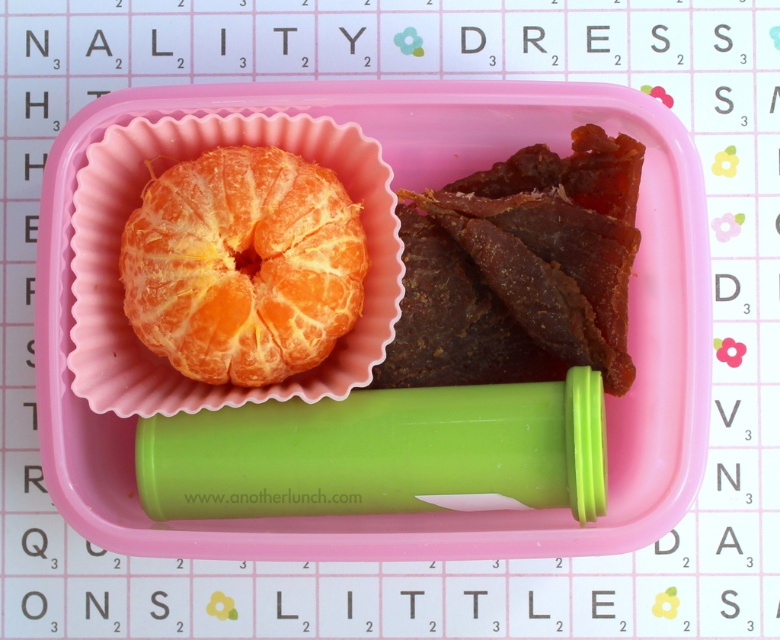
Who is taller, brown/crumbly jerky at right or orangejuicy fleshorange segment at left?

With more height is brown/crumbly jerky at right.

Is point (539, 380) closer to camera compared to point (261, 216)?

No.

Is point (403, 360) less distant than point (193, 342)?

No, it is not.

I want to click on brown/crumbly jerky at right, so click(x=520, y=269).